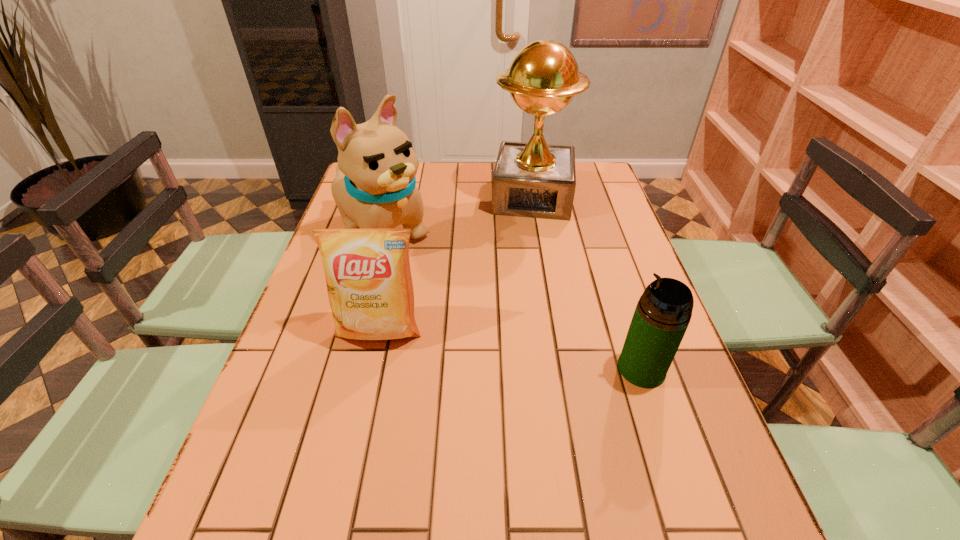
In order to click on vacant space positioned on the face of the second tallest object in this screenshot , I will do `click(441, 278)`.

Identify the location of free space located on the front-facing side of the award. (527, 259).

Image resolution: width=960 pixels, height=540 pixels. I want to click on free space located on the front-facing side of the award, so click(x=521, y=309).

Locate an element on the screen. Image resolution: width=960 pixels, height=540 pixels. free region located 0.230m on the front-facing side of the award is located at coordinates (526, 268).

You are a GUI agent. You are given a task and a screenshot of the screen. Output one action in this format:
    pyautogui.click(x=<x>, y=<y>)
    Task: Click on the object that is at the far edge
    
    Given the screenshot: What is the action you would take?
    pyautogui.click(x=533, y=179)

Locate an element on the screen. This screenshot has height=540, width=960. crisp (potato chip) that is at the left edge is located at coordinates (368, 277).

Where is `puppy located at the left edge`? The height and width of the screenshot is (540, 960). puppy located at the left edge is located at coordinates (375, 187).

Locate an element on the screen. thermos bottle that is positioned at the right edge is located at coordinates (664, 310).

Find the location of a particular element. award located in the right edge section of the desktop is located at coordinates [x=533, y=179].

Identify the location of object that is at the far right corner. (533, 179).